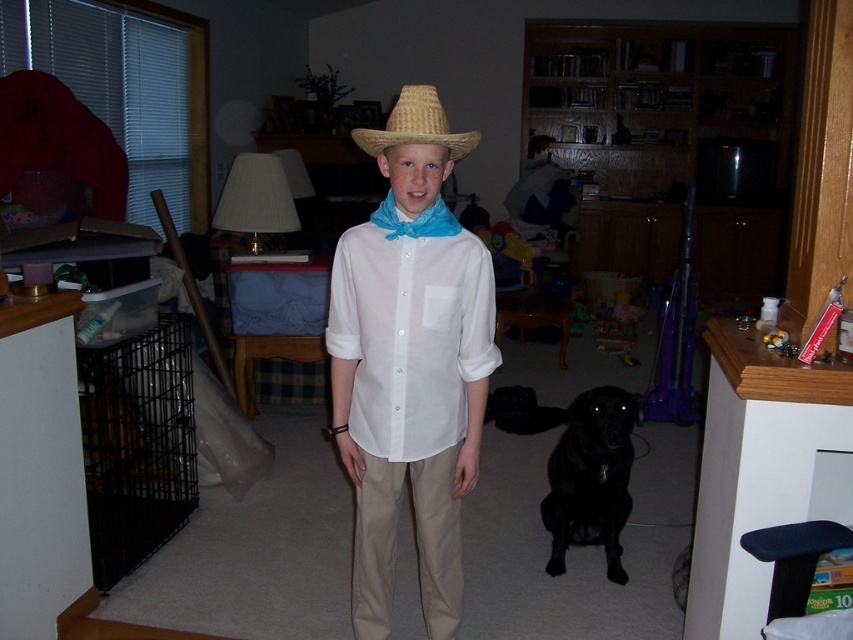
Who is shorter, khaki cotton pants at center or black glossy dog at lower center?

khaki cotton pants at center

Can you confirm if khaki cotton pants at center is shorter than black glossy dog at lower center?

Yes.

This screenshot has height=640, width=853. What do you see at coordinates (415, 544) in the screenshot?
I see `khaki cotton pants at center` at bounding box center [415, 544].

What are the coordinates of `khaki cotton pants at center` in the screenshot? It's located at (415, 544).

Between white sheer shirt at center and strawmaterial/texturecowboy hat at center, which one appears on the left side from the viewer's perspective?

Positioned to the left is white sheer shirt at center.

Does white sheer shirt at center come in front of strawmaterial/texturecowboy hat at center?

No.

Which is in front, point (354, 266) or point (467, 141)?

Positioned in front is point (467, 141).

What are the coordinates of `white sheer shirt at center` in the screenshot? It's located at (410, 328).

The height and width of the screenshot is (640, 853). Find the location of `khaki cotton pants at center`. khaki cotton pants at center is located at coordinates (415, 544).

Who is lower down, khaki cotton pants at center or strawmaterial/texturecowboy hat at center?

khaki cotton pants at center

Which is behind, point (444, 493) or point (363, 141)?

The point (444, 493) is behind.

Where is `khaki cotton pants at center`? The image size is (853, 640). khaki cotton pants at center is located at coordinates (415, 544).